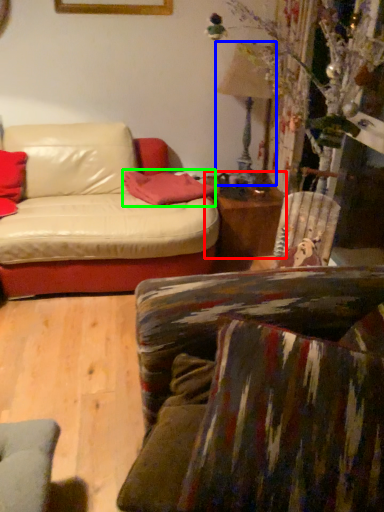
Question: Based on their relative distances, which object is nearer to table (highlighted by a red box)? Choose from lamp (highlighted by a blue box) and pillow (highlighted by a green box).

Choices:
 (A) lamp
 (B) pillow

Answer: (B)